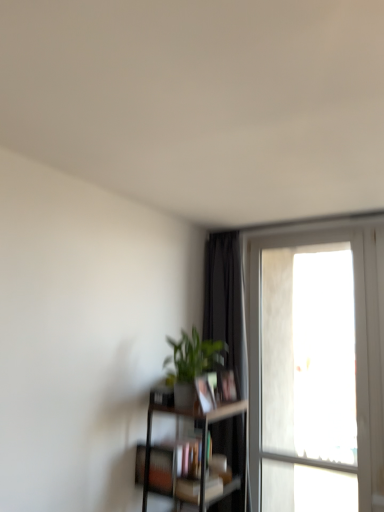
Question: From a real-world perspective, does matte black book at center, the 4th book when ordered from bottom to top, stand above green matte plant at center?

Choices:
 (A) no
 (B) yes

Answer: (A)

Question: Does matte black book at center, placed as the 1th book when sorted from top to bottom, appear on the left side of green matte plant at center?

Choices:
 (A) no
 (B) yes

Answer: (A)

Question: From a real-world perspective, is matte black book at center, the 4th book when ordered from bottom to top, located beneath green matte plant at center?

Choices:
 (A) yes
 (B) no

Answer: (A)

Question: Is matte black book at center, placed as the 1th book when sorted from top to bottom, to the right of green matte plant at center from the viewer's perspective?

Choices:
 (A) yes
 (B) no

Answer: (A)

Question: Can you confirm if matte black book at center, placed as the 1th book when sorted from top to bottom, is wider than green matte plant at center?

Choices:
 (A) no
 (B) yes

Answer: (A)

Question: Considering the relative sizes of matte black book at center, the 4th book when ordered from bottom to top, and green matte plant at center in the image provided, is matte black book at center, the 4th book when ordered from bottom to top, bigger than green matte plant at center?

Choices:
 (A) yes
 (B) no

Answer: (B)

Question: From a real-world perspective, is hardcover book at center, the second book in the top-to-bottom sequence, on dark brown wooden shelf at lower center?

Choices:
 (A) no
 (B) yes

Answer: (B)

Question: Considering the relative sizes of hardcover book at center, the second book in the top-to-bottom sequence, and dark brown wooden shelf at lower center in the image provided, is hardcover book at center, the second book in the top-to-bottom sequence, wider than dark brown wooden shelf at lower center?

Choices:
 (A) yes
 (B) no

Answer: (B)

Question: Would you consider hardcover book at center, the second book in the top-to-bottom sequence, to be distant from dark brown wooden shelf at lower center?

Choices:
 (A) yes
 (B) no

Answer: (B)

Question: Is the position of hardcover book at center, arranged as the 3th book when ordered from the bottom, more distant than that of dark brown wooden shelf at lower center?

Choices:
 (A) yes
 (B) no

Answer: (A)

Question: Is hardcover book at center, the second book in the top-to-bottom sequence, positioned with its back to dark brown wooden shelf at lower center?

Choices:
 (A) yes
 (B) no

Answer: (B)

Question: Considering the relative sizes of hardcover book at center, the second book in the top-to-bottom sequence, and dark brown wooden shelf at lower center in the image provided, is hardcover book at center, the second book in the top-to-bottom sequence, taller than dark brown wooden shelf at lower center?

Choices:
 (A) yes
 (B) no

Answer: (B)

Question: Does hardcover book at center, arranged as the 3th book when ordered from the bottom, have a lesser width compared to matte black bookshelf at lower center, arranged as the 2th book when ordered from the bottom?

Choices:
 (A) yes
 (B) no

Answer: (A)